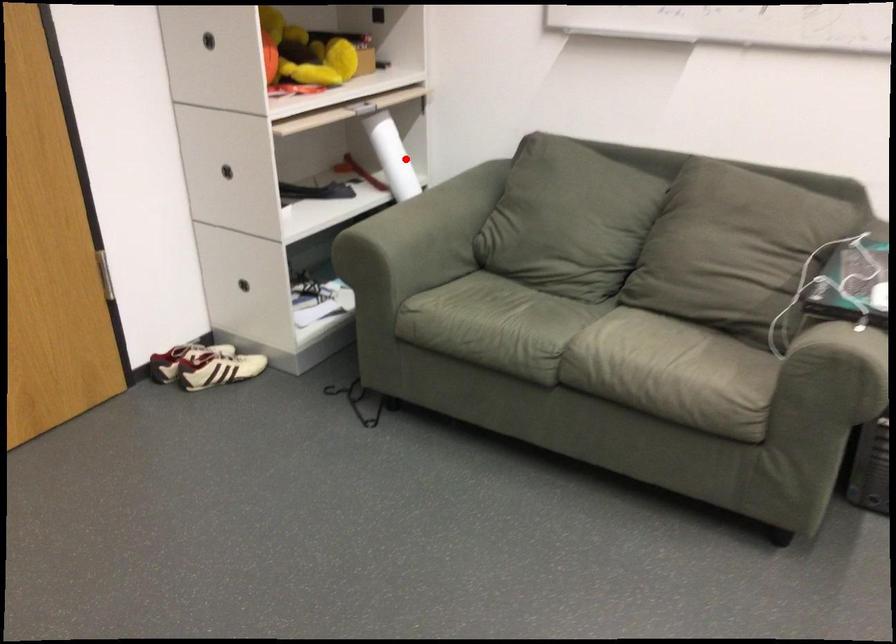
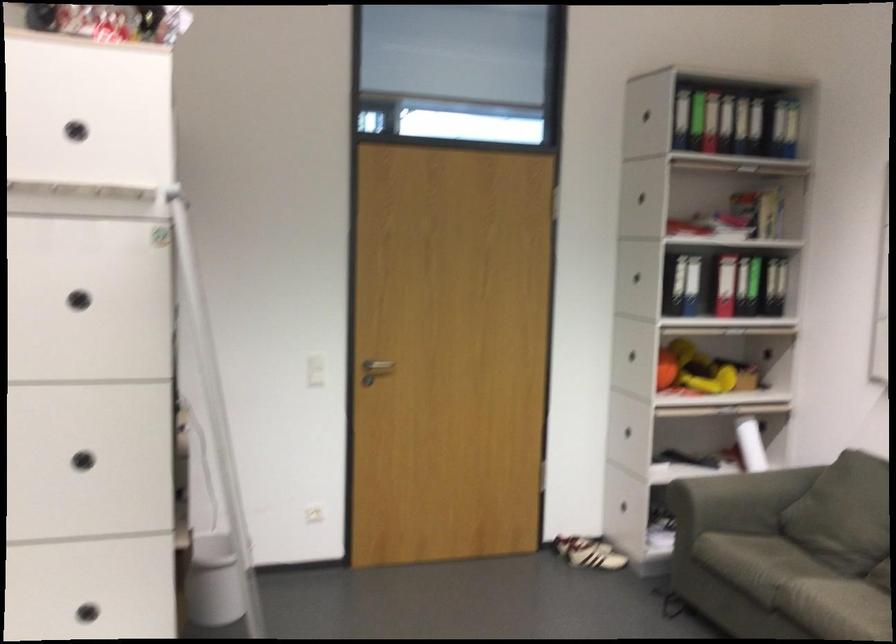
Question: I am providing you with two images of the same scene from different viewpoints. A red point is marked on the first image. At the location where the point appears in image 1, is it still visible in image 2?

Choices:
 (A) Yes
 (B) No

Answer: (A)